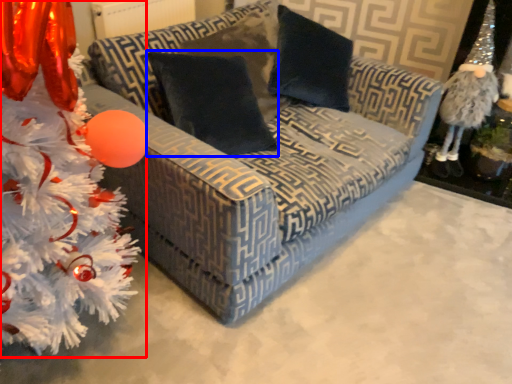
Question: Which object is closer to the camera taking this photo, christmas tree (highlighted by a red box) or pillow (highlighted by a blue box)?

Choices:
 (A) christmas tree
 (B) pillow

Answer: (A)